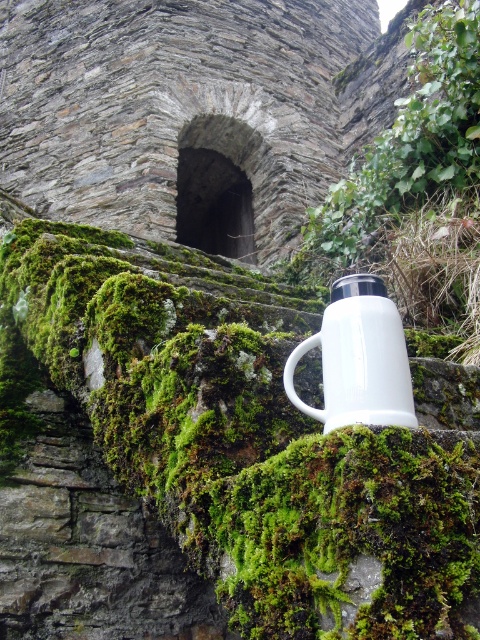
You are a painter who wants to place a new brush holder between the green mossy stone at upper center and the white enamel mug at center. Based on their positions, which object should the brush holder be closer to?

The brush holder should be placed closer to the white enamel mug at center because the green mossy stone at upper center is positioned on the left side of the white enamel mug at center, meaning the mug is to the right of the stone. Therefore, the holder should be placed between them, closer to the mug.

Based on the photo, you are an archaeologist examining the stone structure. You notice the green mossy stone at upper center and the white enamel mug at center. Which object is closer to you as you stand in front of the structure?

The green mossy stone at upper center is closer to you because it is in front of the white enamel mug at center.